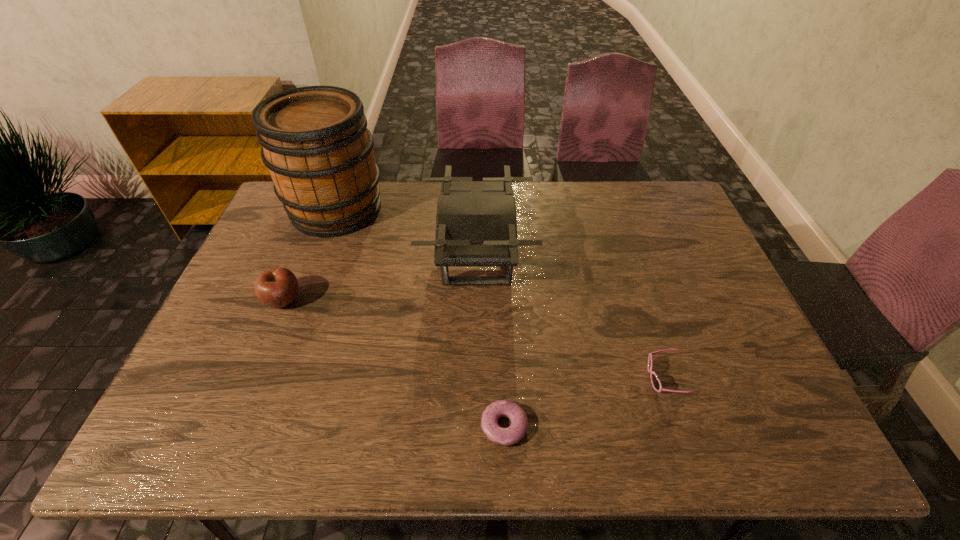
Find the location of a particular element. The height and width of the screenshot is (540, 960). vacant area at the near edge is located at coordinates (646, 445).

At what (x,y) coordinates should I click in order to perform the action: click on blank space at the left edge of the desktop. Please return your answer as a coordinate pair (x, y). The height and width of the screenshot is (540, 960). Looking at the image, I should click on (230, 325).

This screenshot has height=540, width=960. I want to click on vacant space at the right edge of the desktop, so click(692, 348).

At what (x,y) coordinates should I click in order to perform the action: click on vacant position at the near left corner of the desktop. Please return your answer as a coordinate pair (x, y). Looking at the image, I should click on (183, 419).

In the image, there is a desktop. At what (x,y) coordinates should I click in order to perform the action: click on free region at the far right corner. Please return your answer as a coordinate pair (x, y). Looking at the image, I should click on (640, 208).

In the image, there is a desktop. Where is `free region at the near right corner`? free region at the near right corner is located at coordinates (803, 451).

Find the location of `vacant space that is in between the apple and the fourth farthest object`. vacant space that is in between the apple and the fourth farthest object is located at coordinates (473, 339).

Locate an element on the screen. free space between the apple and the fourth tallest object is located at coordinates (473, 339).

Find the location of `free spot between the tallest object and the apple`. free spot between the tallest object and the apple is located at coordinates (310, 254).

The image size is (960, 540). I want to click on vacant point located between the third tallest object and the doughnut, so click(x=394, y=363).